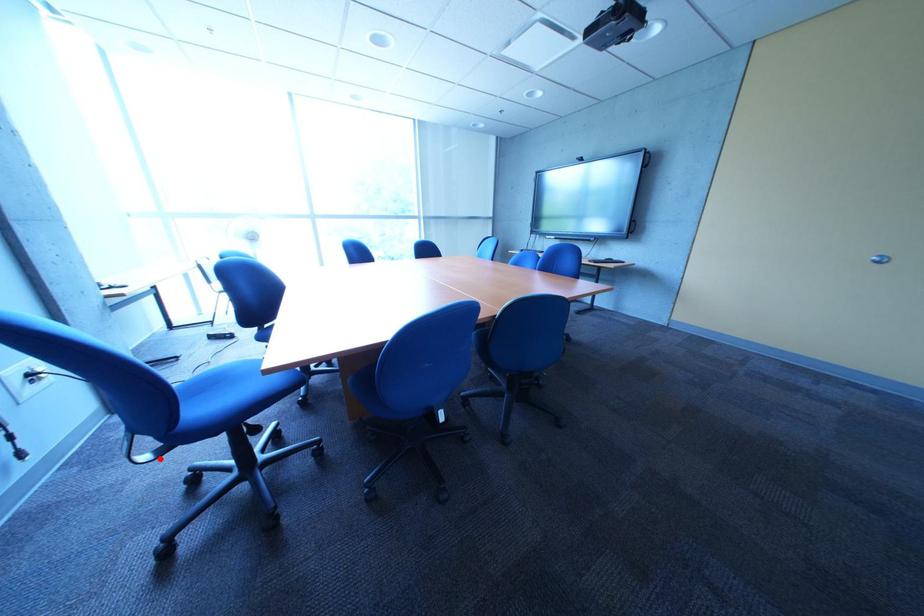
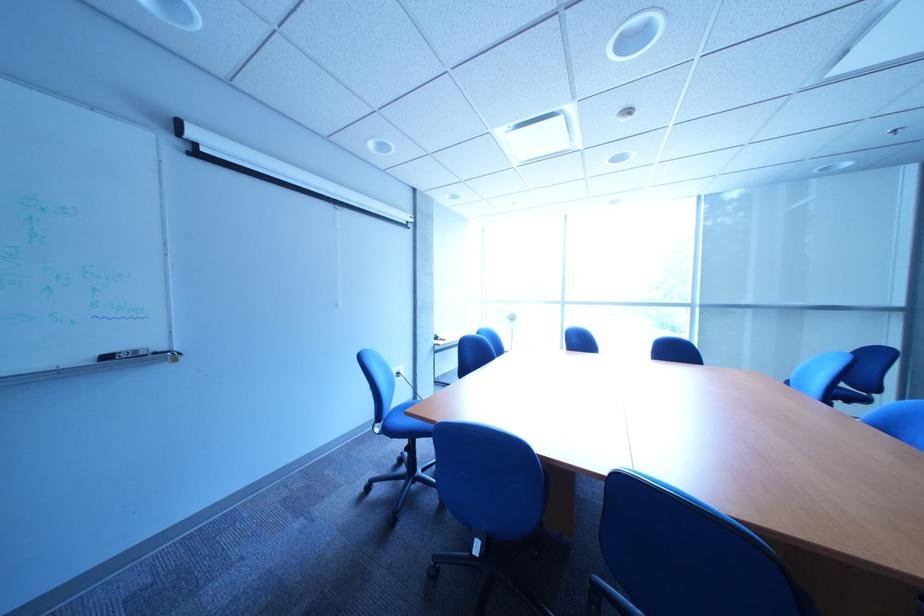
Question: I am providing you with two images of the same scene from different viewpoints. In image1, a red point is highlighted. Considering the same 3D point in image2, which of the following is correct?

Choices:
 (A) It is closer
 (B) It is farther

Answer: (B)